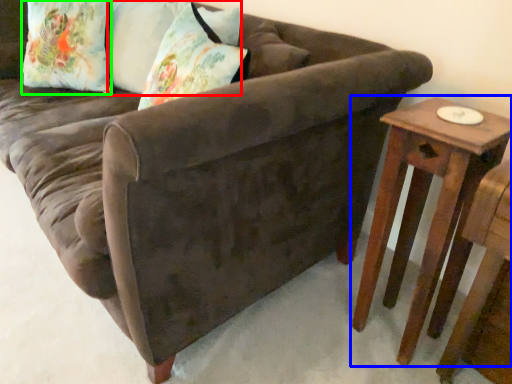
Question: Estimate the real-world distances between objects in this image. Which object is farther from pillow (highlighted by a red box), table (highlighted by a blue box) or pillow (highlighted by a green box)?

Choices:
 (A) table
 (B) pillow

Answer: (A)